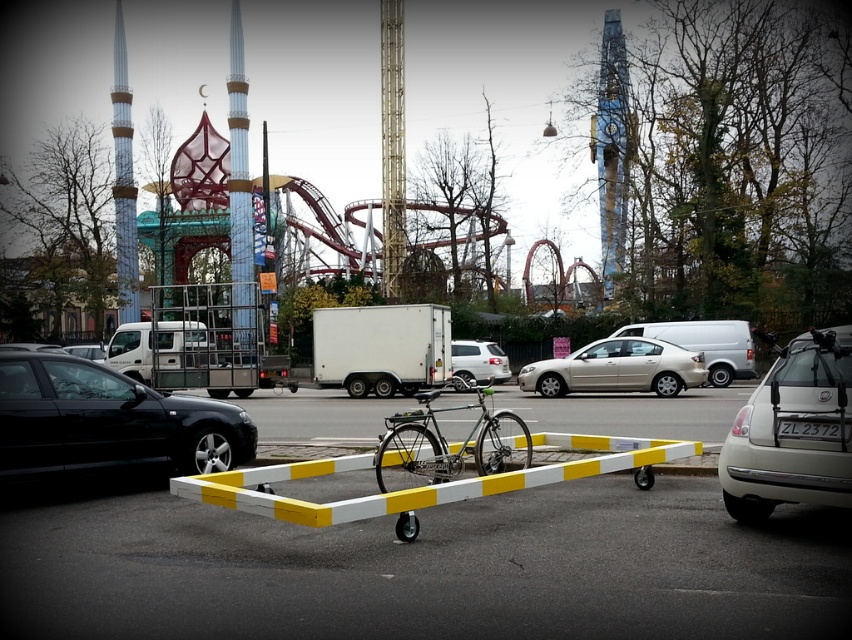
Question: Can you confirm if yellow/white plastic frame at center is wider than white matte car at right?

Choices:
 (A) yes
 (B) no

Answer: (A)

Question: Among these points, which one is nearest to the camera?

Choices:
 (A) (61, 428)
 (B) (465, 378)

Answer: (A)

Question: Which point is farther from the camera taking this photo?

Choices:
 (A) (626, 385)
 (B) (505, 380)
 (C) (7, 456)
 (D) (671, 458)

Answer: (B)

Question: Considering the real-world distances, which object is closest to the yellow/white plastic frame at center?

Choices:
 (A) yellow/white striped barricade at center
 (B) white matte car at center
 (C) gold metallic sedan at center
 (D) shiny metallic bicycle at center

Answer: (A)

Question: Is yellow/white plastic frame at center smaller than gold metallic sedan at center?

Choices:
 (A) no
 (B) yes

Answer: (A)

Question: Does yellow/white plastic frame at center lie in front of gold metallic sedan at center?

Choices:
 (A) no
 (B) yes

Answer: (B)